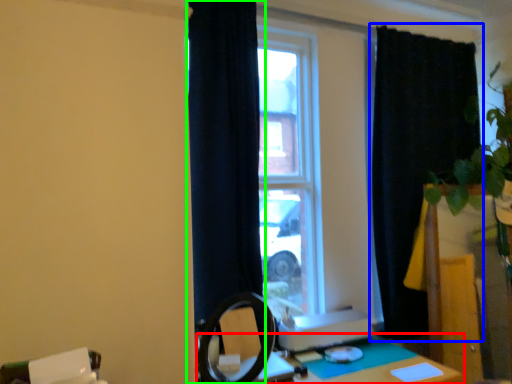
Question: Which object is positioned farthest from table (highlighted by a red box)? Select from curtain (highlighted by a blue box) and curtain (highlighted by a green box).

Choices:
 (A) curtain
 (B) curtain

Answer: (A)